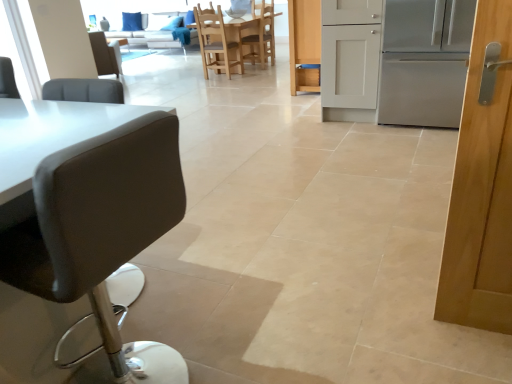
Question: Is wooden chair at center, the second chair in the top-to-bottom sequence, at the left side of white fabric couch at upper center?

Choices:
 (A) yes
 (B) no

Answer: (B)

Question: Is wooden chair at center, the 3th chair from the back, beside white fabric couch at upper center?

Choices:
 (A) no
 (B) yes

Answer: (A)

Question: Is white fabric couch at upper center located within wooden chair at center, positioned as the second chair in front-to-back order?

Choices:
 (A) no
 (B) yes

Answer: (A)

Question: Does wooden chair at center, the 3th chair in the bottom-to-top sequence, turn towards white fabric couch at upper center?

Choices:
 (A) no
 (B) yes

Answer: (A)

Question: From a real-world perspective, is wooden chair at center, which appears as the third chair when viewed from the right, physically above white fabric couch at upper center?

Choices:
 (A) no
 (B) yes

Answer: (B)

Question: Would you say wooden chair at center, the 3th chair in the bottom-to-top sequence, is outside white fabric couch at upper center?

Choices:
 (A) yes
 (B) no

Answer: (A)

Question: Is matte black stool at left, which is the first chair in front-to-back order, shorter than wooden chair at center, the 3th chair from the back?

Choices:
 (A) yes
 (B) no

Answer: (B)

Question: Is the position of matte black stool at left, positioned as the 3th chair in left-to-right order, less distant than that of wooden chair at center, which appears as the third chair when viewed from the right?

Choices:
 (A) yes
 (B) no

Answer: (A)

Question: Can you confirm if matte black stool at left, which is the first chair in front-to-back order, is positioned to the left of wooden chair at center, the second chair in the top-to-bottom sequence?

Choices:
 (A) yes
 (B) no

Answer: (B)

Question: From a real-world perspective, does matte black stool at left, acting as the fourth chair starting from the back, stand above wooden chair at center, which appears as the 2th chair when viewed from the left?

Choices:
 (A) no
 (B) yes

Answer: (A)

Question: From the image's perspective, is matte black stool at left, which is the first chair in front-to-back order, on wooden chair at center, the 3th chair from the back?

Choices:
 (A) no
 (B) yes

Answer: (A)

Question: Is matte black stool at left, the 2th chair positioned from the right, bigger than wooden chair at center, the 3th chair in the bottom-to-top sequence?

Choices:
 (A) no
 (B) yes

Answer: (B)

Question: Is light brown wooden chair at center, arranged as the first chair when viewed from the right, surrounding wooden chair at center, the 3th chair from the back?

Choices:
 (A) no
 (B) yes

Answer: (A)